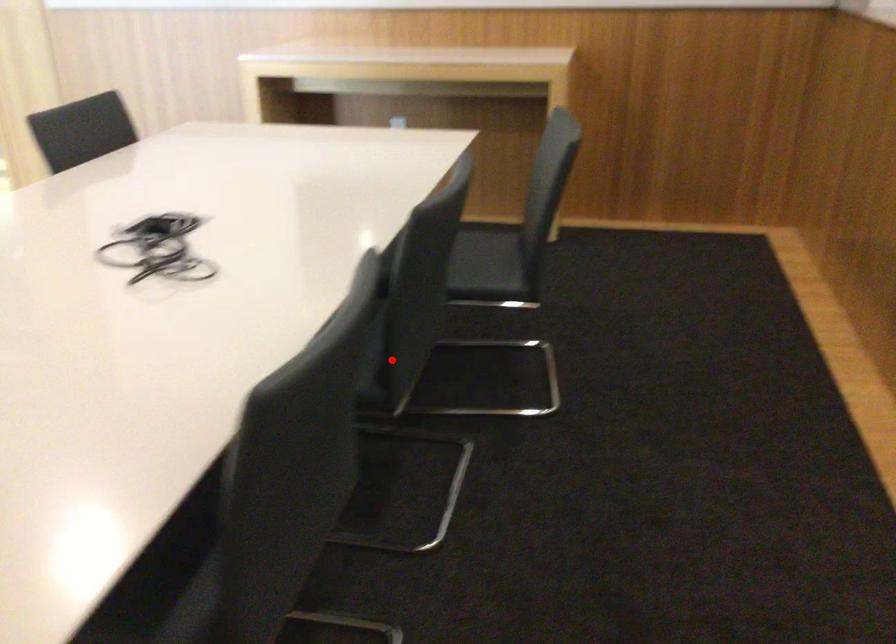
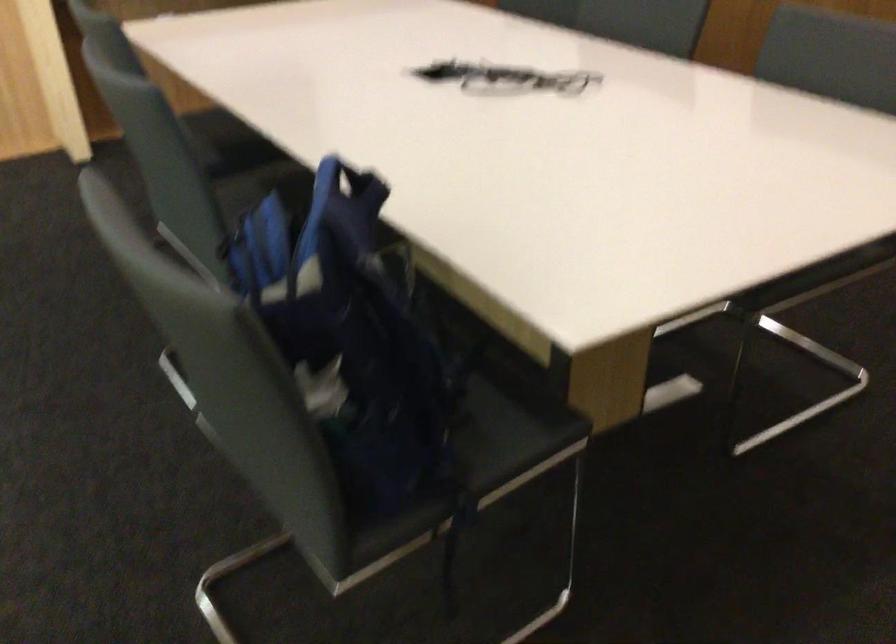
Question: I am providing you with two images of the same scene from different viewpoints. A red point is marked on the first image. Can you still see the location of the red point in image 2?

Choices:
 (A) Yes
 (B) No

Answer: (B)